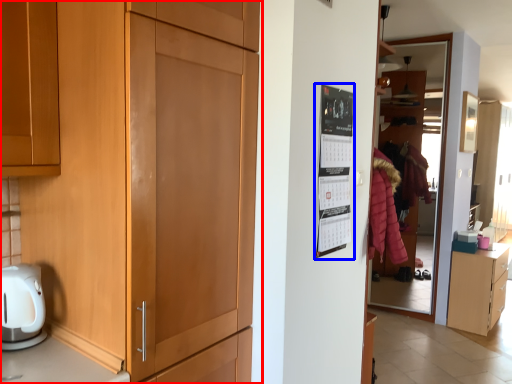
Question: Which of the following is the farthest to the observer, cupboard (highlighted by a red box) or bulletin board (highlighted by a blue box)?

Choices:
 (A) cupboard
 (B) bulletin board

Answer: (B)